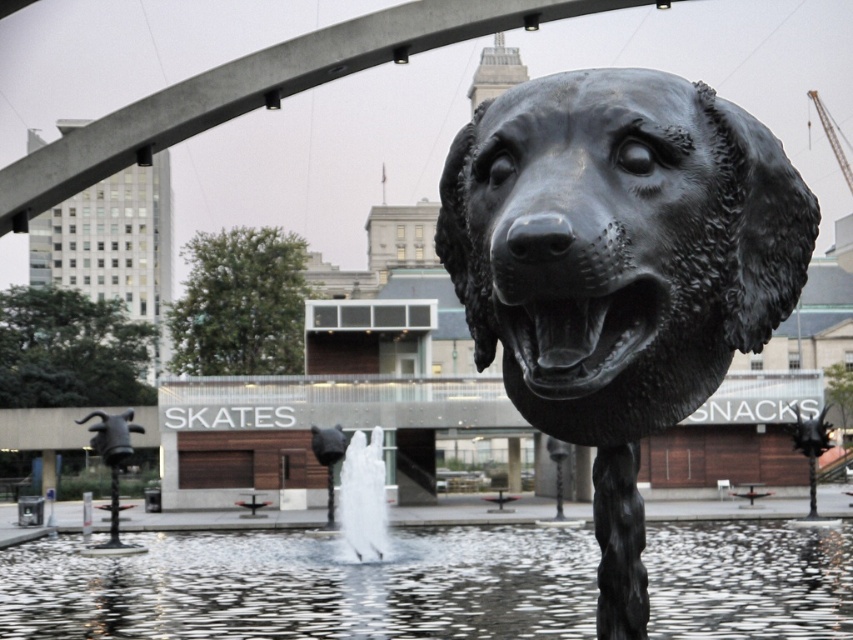
Can you confirm if black polished dog head at center is positioned to the right of white frothy water at center?

Correct, you'll find black polished dog head at center to the right of white frothy water at center.

Is black polished dog head at center wider than white frothy water at center?

No.

At what (x,y) coordinates should I click in order to perform the action: click on black polished dog head at center. Please return your answer as a coordinate pair (x, y). Looking at the image, I should click on (619, 244).

Is black polished dog head at center positioned at the back of clear water at center?

No, black polished dog head at center is in front of clear water at center.

Is point (561, 264) positioned in front of point (781, 600)?

Yes, it is.

Between point (637, 74) and point (268, 582), which one is positioned in front?

Point (637, 74) is more forward.

Locate an element on the screen. The image size is (853, 640). black polished dog head at center is located at coordinates (619, 244).

Who is taller, clear water at center or white frothy water at center?

With more height is clear water at center.

Can you confirm if clear water at center is positioned above white frothy water at center?

Yes, clear water at center is above white frothy water at center.

Describe the element at coordinates (306, 586) in the screenshot. I see `clear water at center` at that location.

Image resolution: width=853 pixels, height=640 pixels. Find the location of `clear water at center`. clear water at center is located at coordinates (306, 586).